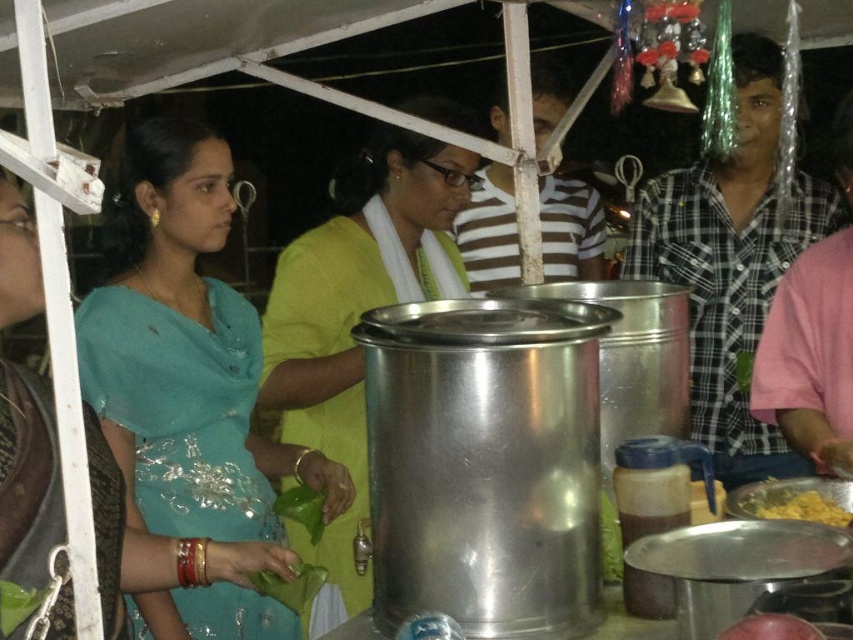
Question: Does teal silk saree at left lie behind checkered fabric shirt at right?

Choices:
 (A) yes
 (B) no

Answer: (B)

Question: Is matte green blouse at center bigger than yellow matte food at lower right?

Choices:
 (A) no
 (B) yes

Answer: (B)

Question: Observing the image, what is the correct spatial positioning of teal silk saree at left in reference to matte green blouse at center?

Choices:
 (A) above
 (B) below

Answer: (B)

Question: Estimate the real-world distances between objects in this image. Which object is closer to the teal silk saree at left?

Choices:
 (A) yellow matte food at lower right
 (B) smooth red apple at center
 (C) checkered fabric shirt at right
 (D) matte green blouse at center

Answer: (D)

Question: Which point is farther to the camera?

Choices:
 (A) teal silk saree at left
 (B) matte green blouse at center
 (C) checkered fabric shirt at right

Answer: (C)

Question: Estimate the real-world distances between objects in this image. Which object is closer to the matte green blouse at center?

Choices:
 (A) yellow matte food at lower right
 (B) smooth red apple at center

Answer: (A)